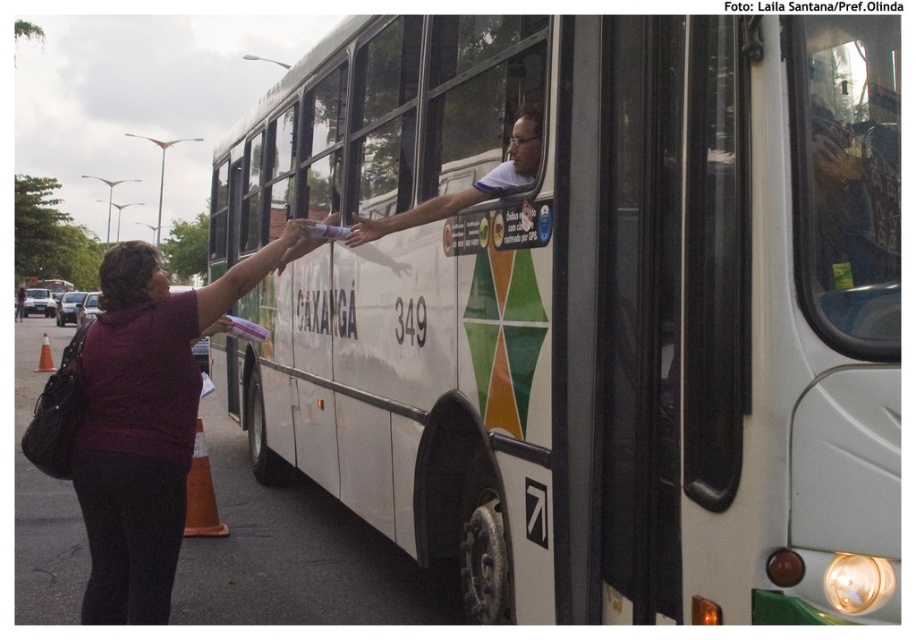
Based on the photo, you are standing at the point labeled point (770, 588) and want to move to the point labeled point (101, 280). Which direction should you move in to get closer to your destination?

You should move towards the direction away from the viewer since point (101, 280) is further from the viewer compared to point (770, 588).

You are standing at the point marked as point [142,417] and want to take a photo of the bus. If your camera is 3.09 meters away from the point, will the entire bus fit in the camera frame?

The point [142,417] and camera are 3.09 meters apart from each other. Since the distance matches the camera position, the entire bus should fit in the frame if the camera has a wide enough angle. However, without knowing the camera lens specifications, it is impossible to confirm.

You are a delivery person who needs to place a package between the white matte bus at center and the purple matte shirt at left. The package requires 1.5 meters of space to be placed safely. Is there enough space between them?

The white matte bus at center is 1.47 meters away from purple matte shirt at left. Since the required space is 1.5 meters, there isn t enough space to place the package safely between them.